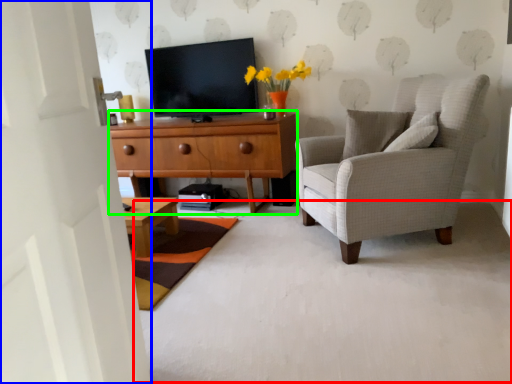
Question: Which is farther away from plain (highlighted by a red box)? door (highlighted by a blue box) or cabinetry (highlighted by a green box)?

Choices:
 (A) door
 (B) cabinetry

Answer: (B)